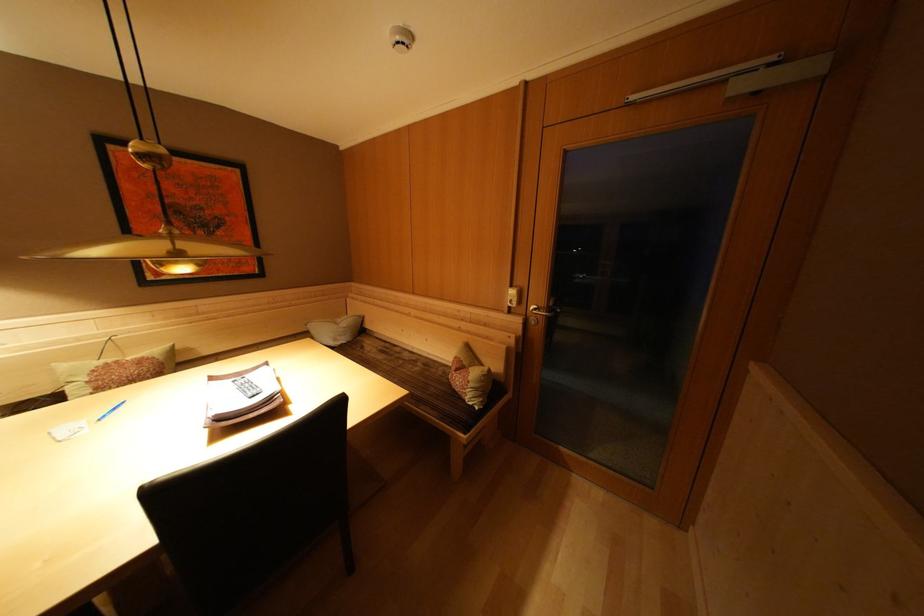
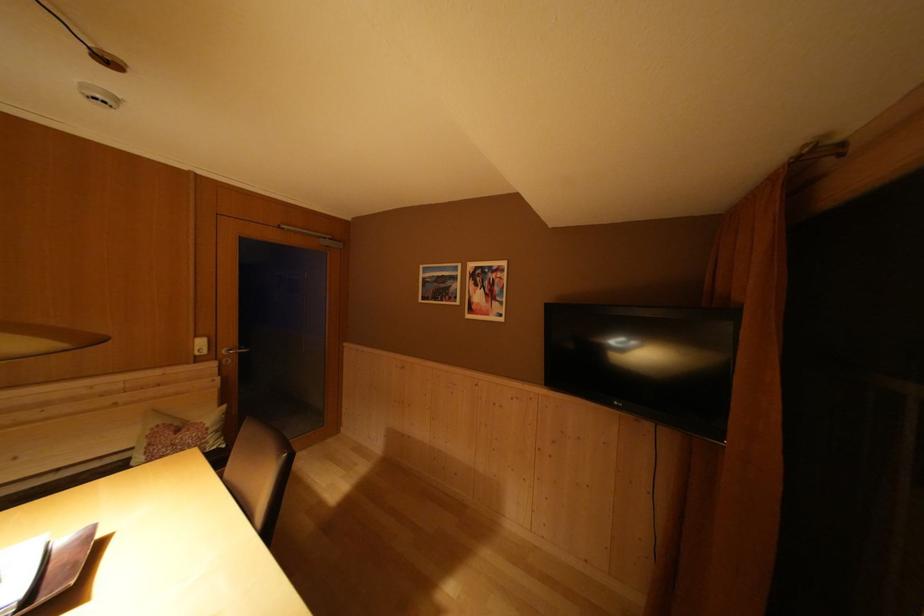
Where in the second image is the point corresponding to point (483, 413) from the first image?

(231, 451)